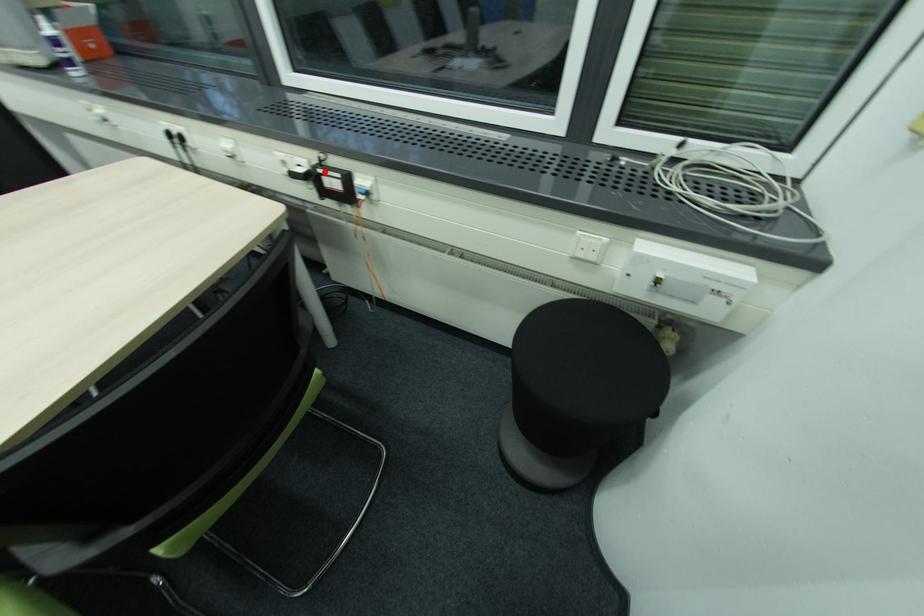
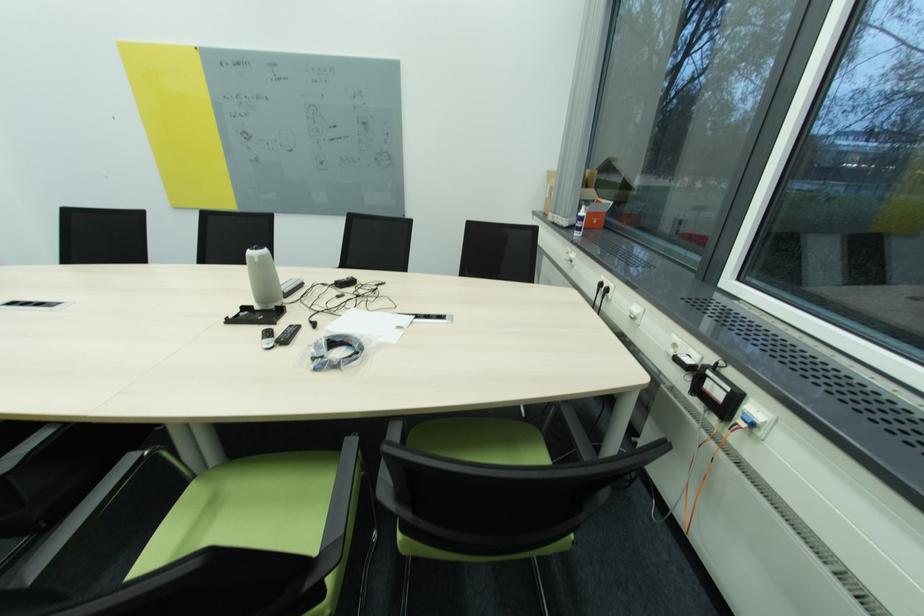
Find the pixel in the second image that matches the highlighted location in the first image.

(713, 373)